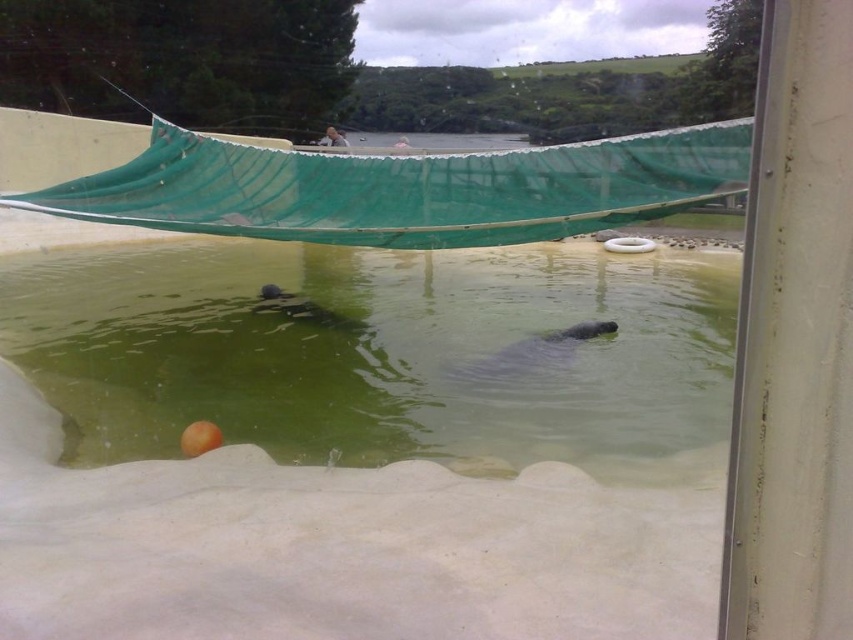
You are a zookeeper observing the pool area. You notice two otters in the water. Which otter is positioned lower in the water between the gray matte otter at center and the smooth gray otter at center?

The gray matte otter at center is positioned lower in the water than the smooth gray otter at center.

You are a zookeeper planning to place a new feeding station in the pool. The feeding station requires a space wider than the smooth gray otter at center. Can the greenish water at center accommodate the feeding station?

The greenish water at center has a width larger than the smooth gray otter at center, so it can accommodate the feeding station requiring a space wider than the otter.